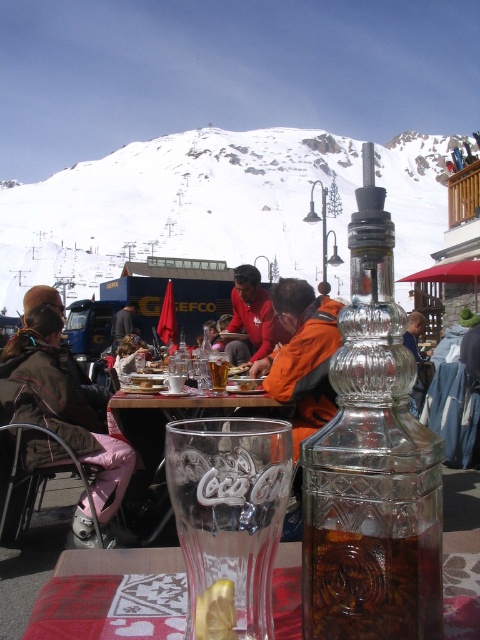
Question: Which point is closer to the camera taking this photo?

Choices:
 (A) (218, 388)
 (B) (324, 554)
 (C) (165, 404)

Answer: (B)

Question: Does pink fabric pants at lower left have a lesser width compared to translucent glass cup at center?

Choices:
 (A) no
 (B) yes

Answer: (A)

Question: Is transparent glass bottle at center to the left of brown glass bottle at center from the viewer's perspective?

Choices:
 (A) no
 (B) yes

Answer: (A)

Question: Which point is closer to the camera?

Choices:
 (A) (369, 209)
 (B) (216, 385)
 (C) (327, 566)
 (D) (223, 584)

Answer: (D)

Question: Does transparent glass bottle at center have a smaller size compared to pink fabric pants at lower left?

Choices:
 (A) yes
 (B) no

Answer: (A)

Question: Which point is closer to the camera?

Choices:
 (A) red woven cloth at lower center
 (B) brown glass bottle at center
 (C) translucent glass cup at center
 (D) pink fabric pants at lower left

Answer: (B)